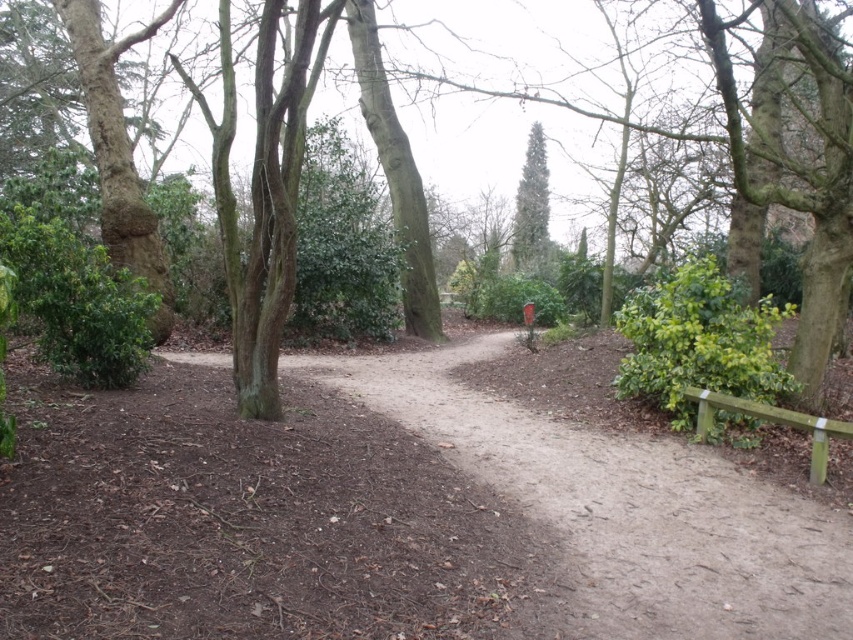
Question: Estimate the real-world distances between objects in this image. Which object is closer to the dirt path at center?

Choices:
 (A) green wooden bench at right
 (B) green glossy tree at center

Answer: (A)

Question: Is green glossy tree at center above green wooden bench at right?

Choices:
 (A) yes
 (B) no

Answer: (A)

Question: Which point is closer to the camera taking this photo?

Choices:
 (A) (517, 211)
 (B) (726, 595)

Answer: (B)

Question: Based on their relative distances, which object is farther from the green wooden bench at right?

Choices:
 (A) dirt path at center
 (B) green glossy tree at center

Answer: (B)

Question: In this image, where is dirt path at center located relative to green glossy tree at center?

Choices:
 (A) below
 (B) above

Answer: (A)

Question: Does green glossy tree at center have a smaller size compared to green wooden bench at right?

Choices:
 (A) yes
 (B) no

Answer: (B)